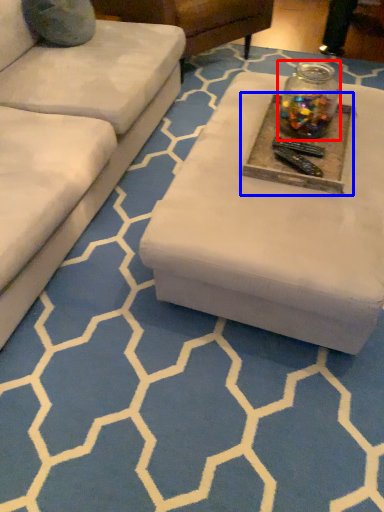
Question: Which of the following is the farthest to the observer, glass jar (highlighted by a red box) or round table (highlighted by a blue box)?

Choices:
 (A) glass jar
 (B) round table

Answer: (A)